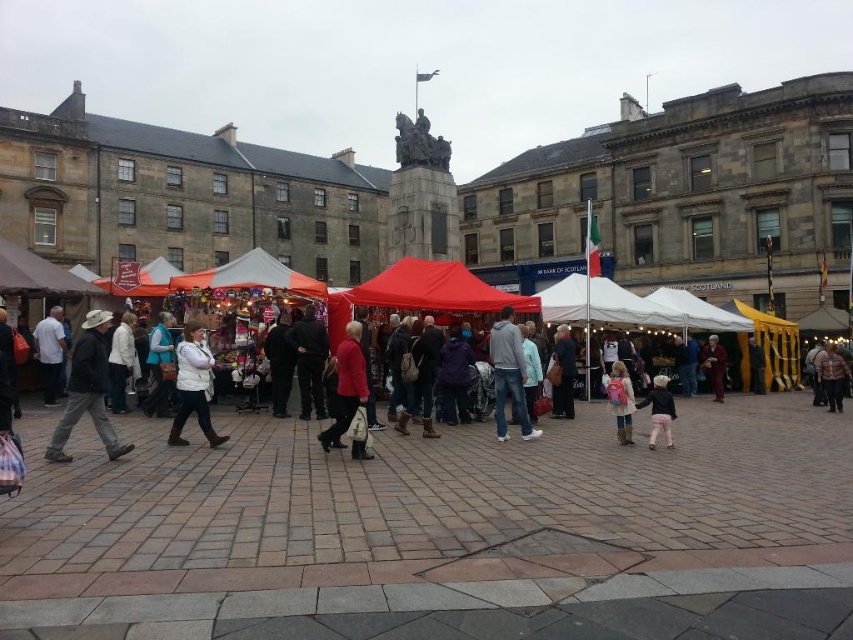
You are a customer at the market and want to find an outfit that stands out. You notice the matte red coat at center and the light pink fabric pants at lower right. Which item is taller?

The matte red coat at center is taller than the light pink fabric pants at lower right.

You are a tailor who needs to determine which clothing item has a narrower width between the matte red coat at center and the light pink fabric pants at lower right. According to the scene description, which one is narrower?

The matte red coat at center is thinner than the light pink fabric pants at lower right, so the matte red coat at center is narrower in width.

Consider the image. You are a delivery person who needs to place a 2.5 meter long box between the white fleece vest at center and the pink backpack at center. Is there enough space to fit the box without overlapping either item?

The white fleece vest at center and pink backpack at center are 20.38 meters apart from each other. Since the box is only 2.5 meters long, there is more than enough space to place it between them without overlapping either item.